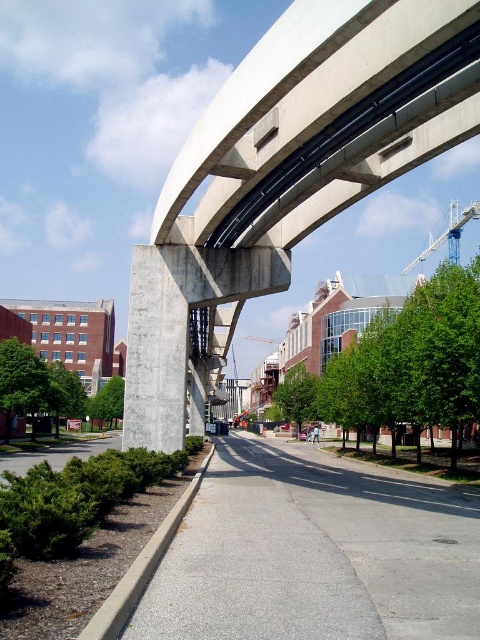
You are standing at the point marked as point (286,177) in the image. What type of structure is located at that point?

The structure at point (286,177) is a concrete smooth overpass at upper center.